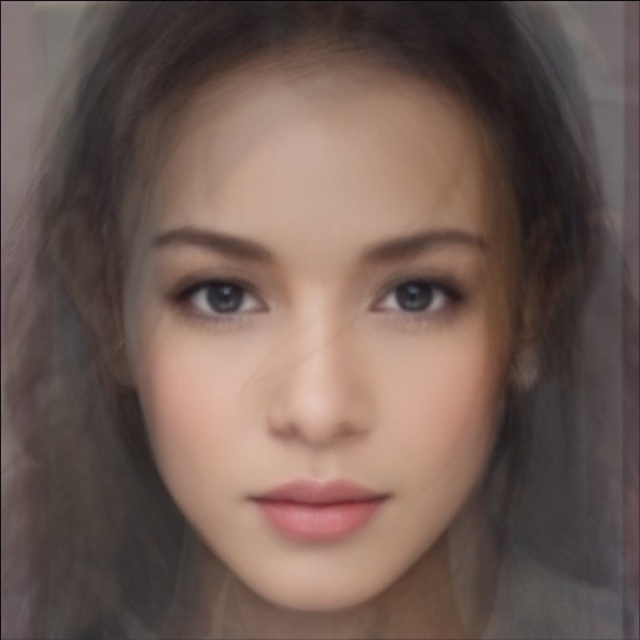
You are holding a camera and want to take a photo of the person in the scene. The camera has a focus ring that can adjust focus distance. The focus ring is currently set to 10 inches. If you want to ensure the point at point (x=371, y=259) is in focus, should you turn the focus ring clockwise or counterclockwise?

The point at point (x=371, y=259) is 10.37 inches from the camera. Since the focus ring is set to 10 inches, you should turn the focus ring clockwise to increase the focus distance to match the 10.37 inches required for the point to be in focus.

Looking at the person in the image, which object is positioned higher up on the face between the smooth skin face at center and the matte brown eye at center?

The smooth skin face at center is taller than the matte brown eye at center, so the smooth skin face at center is positioned higher up on the face.

In the scene shown: You are a photographer using a camera with a focal length of 50mm. You want to capture a close portrait of the smooth skin face at center. If the recommended distance for this focal length to avoid distortion is between 10 to 12 inches, is the current distance too close?

The smooth skin face at center is at a distance of 9.50 inches from the viewer. Since the recommended distance is between 10 to 12 inches, the current distance is slightly too close, which may cause some distortion in the photograph.